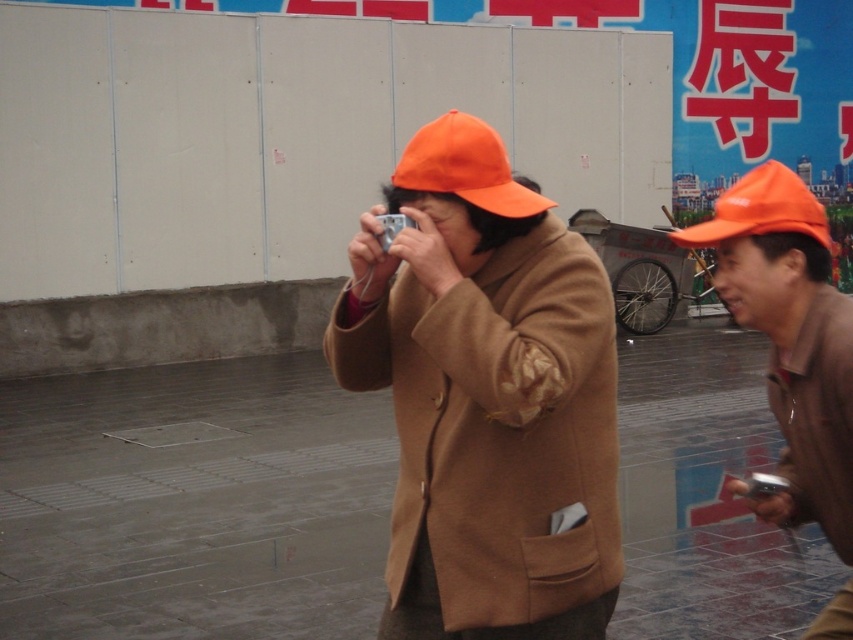
You are a photographer trying to capture both the matte orange cap at center and the orange matte hat at upper right in a single frame. Which object should you adjust your camera angle to focus on first to ensure both are in the frame?

Since the matte orange cap at center has a lesser width compared to orange matte hat at upper right, you should focus on the orange matte hat at upper right first because it is larger and might require more space in the frame to capture fully.

You are a photographer standing at the edge of a large urban plaza. You notice two orange caps in the scene described. The first is an orange fabric cap at center, and the second is an orange matte hat at upper right. You want to capture a photo that includes both caps in the frame. Given their distance apart, can your camera, which has a maximum focal length of 50mm, successfully include both in the shot?

The orange fabric cap at center and orange matte hat at upper right are 19.27 feet apart. With a 50mm lens, which typically has a field of view wide enough to capture subjects 19.27 feet apart at standard shooting distances, it should be possible to include both in the frame.

You are standing at the point with coordinates point (566,326) and want to walk to the point with coordinates point (805,413). Which direction should you move to reach your destination?

To reach point (805,413) from point (566,326), you should move towards the upper right direction since the destination point is located at a higher coordinate in both x and y axes compared to the starting point.